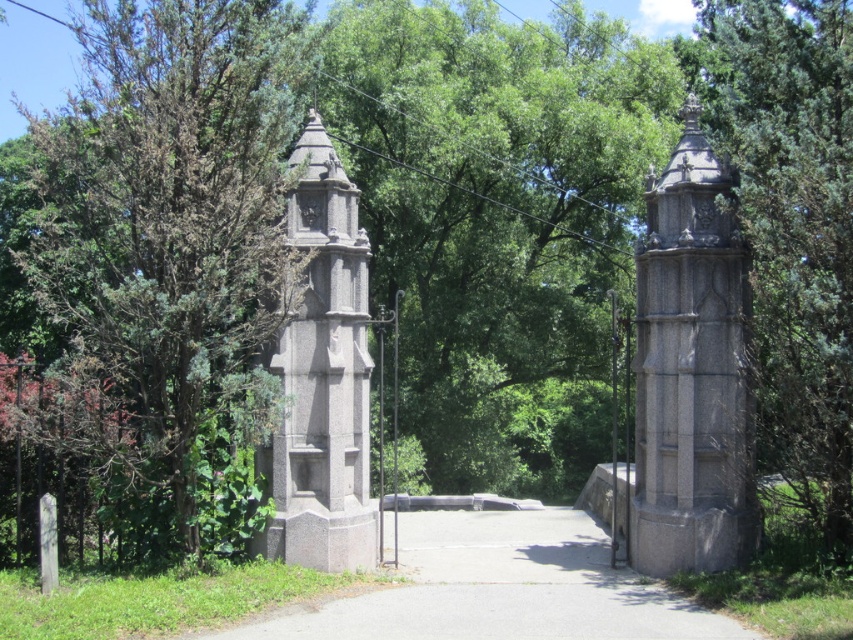
Does green textured stone pillar at center appear on the right side of granite tower at center?

Yes, green textured stone pillar at center is to the right of granite tower at center.

Is green textured stone pillar at center further to camera compared to granite tower at center?

No, green textured stone pillar at center is closer to the viewer.

Which is in front, point (759, 81) or point (635, 356)?

Point (759, 81) is more forward.

The width and height of the screenshot is (853, 640). I want to click on green textured stone pillar at center, so click(x=791, y=228).

Is green textured stone pillar at center positioned at the back of gray concrete path at center?

Yes, it is.

Is point (734, 83) positioned after point (465, 538)?

Yes, point (734, 83) is behind point (465, 538).

I want to click on green textured stone pillar at center, so click(x=791, y=228).

Who is taller, granite tower at center or gray stone tower at left?

Standing taller between the two is granite tower at center.

Who is shorter, granite tower at center or gray stone tower at left?

gray stone tower at left

Is point (672, 419) farther from viewer compared to point (309, 140)?

That is False.

At what (x,y) coordinates should I click in order to perform the action: click on granite tower at center. Please return your answer as a coordinate pair (x, y). Looking at the image, I should click on (689, 369).